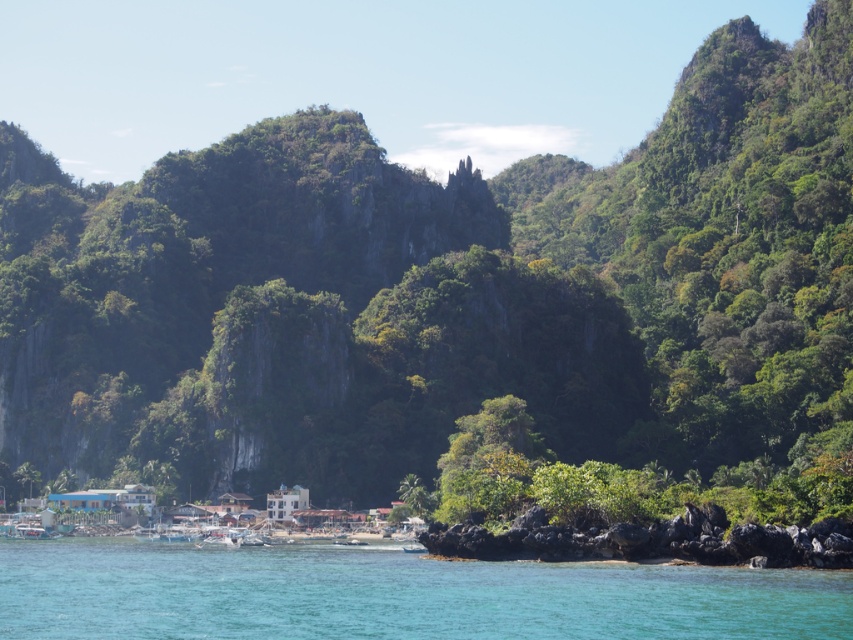
Question: Which point is closer to the camera?

Choices:
 (A) (103, 582)
 (B) (531, 518)

Answer: (A)

Question: Observing the image, what is the correct spatial positioning of clear blue water at lower center in reference to volcanic rock at lower right?

Choices:
 (A) above
 (B) below

Answer: (B)

Question: Does clear blue water at lower center lie behind volcanic rock at lower right?

Choices:
 (A) no
 (B) yes

Answer: (A)

Question: Which of the following is the farthest from the observer?

Choices:
 (A) (749, 541)
 (B) (653, 593)

Answer: (A)

Question: Does clear blue water at lower center appear under volcanic rock at lower right?

Choices:
 (A) no
 (B) yes

Answer: (B)

Question: Among these points, which one is farthest from the camera?

Choices:
 (A) (807, 528)
 (B) (796, 630)

Answer: (A)